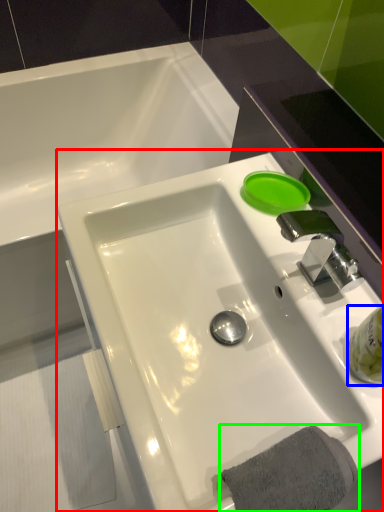
Question: Estimate the real-world distances between objects in this image. Which object is farther from sink (highlighted by a red box), liquid (highlighted by a blue box) or bath towel (highlighted by a green box)?

Choices:
 (A) liquid
 (B) bath towel

Answer: (A)